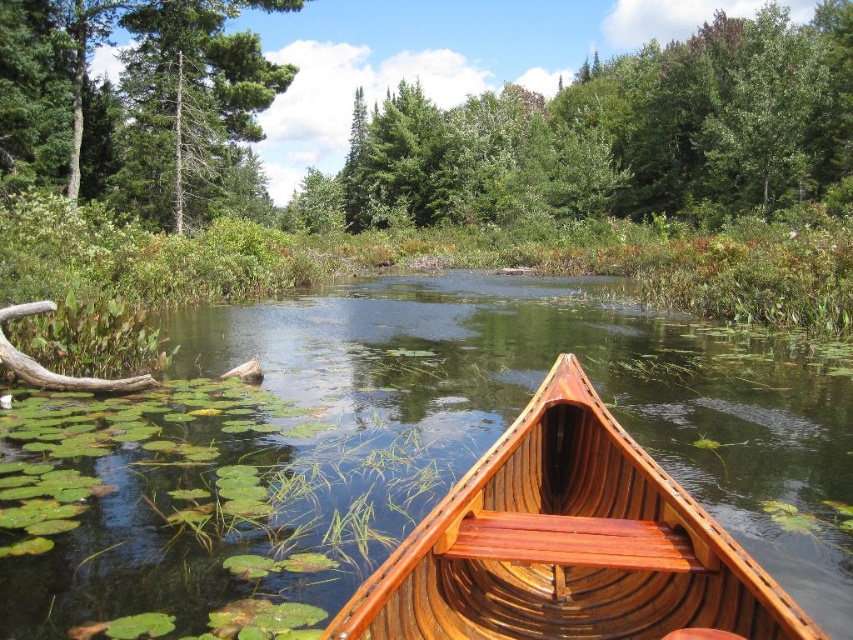
Question: Does glossy wood canoe at center have a lesser width compared to shiny brown canoe at center?

Choices:
 (A) yes
 (B) no

Answer: (B)

Question: Which point is farther to the camera?

Choices:
 (A) (136, 56)
 (B) (685, 472)
 (C) (654, 595)

Answer: (A)

Question: Estimate the real-world distances between objects in this image. Which object is closer to the green matte tree at upper left?

Choices:
 (A) shiny brown canoe at center
 (B) wooden paddle at center

Answer: (A)

Question: Does glossy wood canoe at center have a smaller size compared to shiny brown canoe at center?

Choices:
 (A) yes
 (B) no

Answer: (B)

Question: Which object is the farthest from the wooden paddle at center?

Choices:
 (A) green leafy tree at upper center
 (B) glossy wood canoe at center
 (C) shiny brown canoe at center
 (D) green matte tree at upper left

Answer: (A)

Question: Can you confirm if green leafy tree at upper center is positioned to the left of green matte tree at upper left?

Choices:
 (A) yes
 (B) no

Answer: (B)